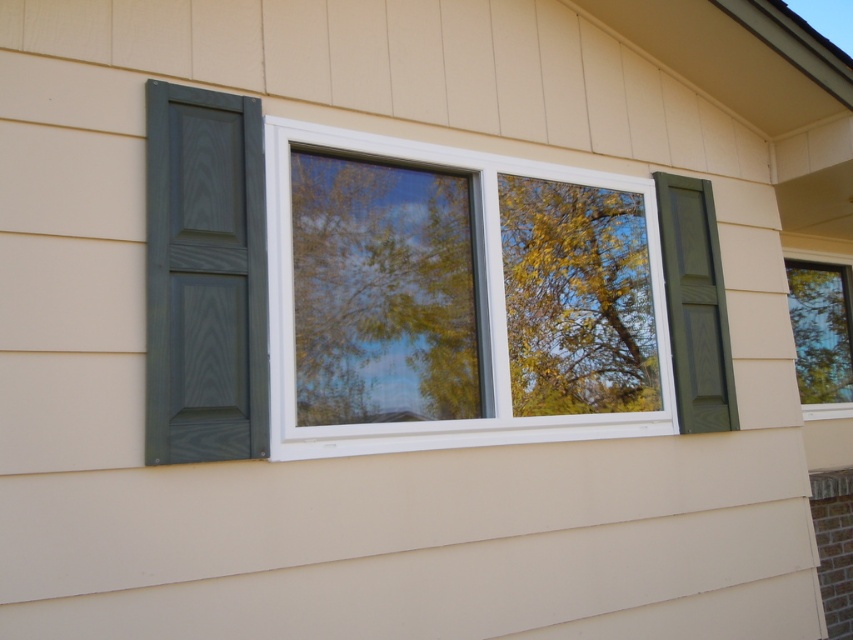
You are a painter planning to paint the green wood shutter at right and the transparent glass window at center. You need to know their positions relative to each other. Which object is located to the left of the other?

The green wood shutter at right is positioned on the left side of transparent glass window at center, so the green wood shutter at right is to the left of the transparent glass window at center.

You are standing in front of the house wall and want to place a small sticker on the exterior wall. You have two options for placement coordinates, point A at point (352, 211) and point B at point (821, 355). Which point is closer to you?

Point A at point (352, 211) is closer to the viewer than point B at point (821, 355).